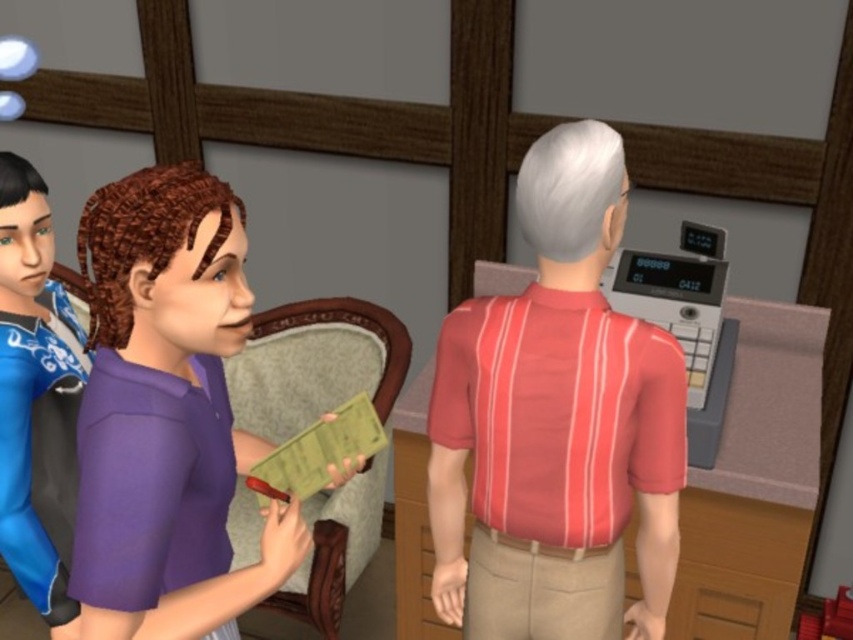
Does velvet green chair at center left have a lesser height compared to velvet upholstered chair at center left?

No.

Which is behind, point (317, 588) or point (56, 541)?

Point (317, 588)

Is point (282, 605) positioned in front of point (4, 321)?

No, (282, 605) is further to viewer.

Identify the location of velvet green chair at center left. [x=315, y=364].

Is point (109, 564) positioned before point (236, 388)?

Yes, point (109, 564) is in front of point (236, 388).

Between purple matte shirt at center and velvet green chair at center left, which one appears on the left side from the viewer's perspective?

Positioned to the left is purple matte shirt at center.

Between point (209, 632) and point (405, 348), which one is positioned behind?

The point (405, 348) is more distant.

Identify the location of purple matte shirt at center. Image resolution: width=853 pixels, height=640 pixels. [166, 413].

Which is below, red striped shirt at center or velvet upholstered chair at center left?

velvet upholstered chair at center left is below.

Find the location of `red striped shirt at center`. red striped shirt at center is located at coordinates (x=556, y=422).